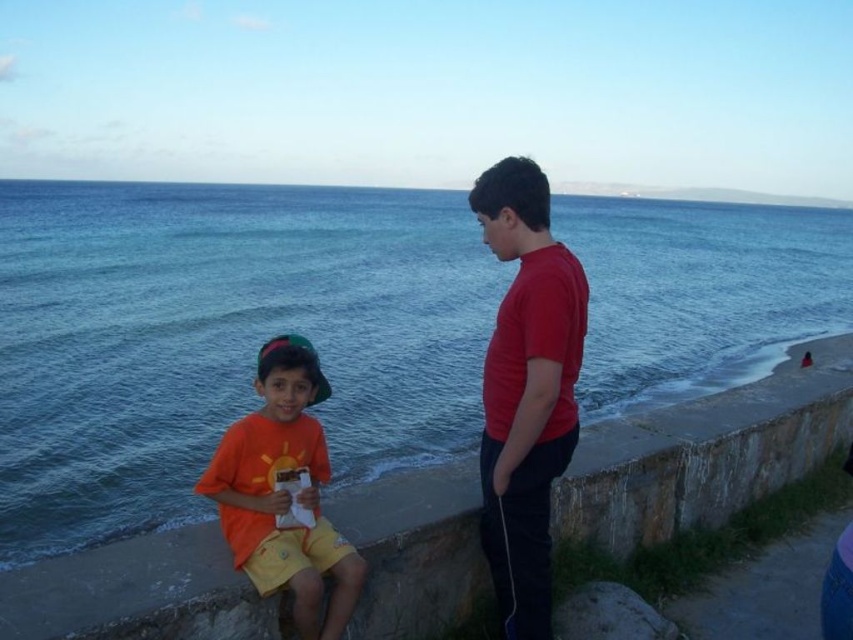
Between blue water at sea left and matte red shirt at right, which one is positioned lower?

matte red shirt at right is below.

Measure the distance between point (762, 310) and camera.

They are 27.11 meters apart.

Where is `blue water at sea left`? blue water at sea left is located at coordinates (219, 339).

Is point (549, 250) more distant than point (270, 580)?

Yes, point (549, 250) is behind point (270, 580).

Can you confirm if matte red shirt at right is bigger than orange matte shirt at center?

Actually, matte red shirt at right might be smaller than orange matte shirt at center.

Describe the element at coordinates (526, 388) in the screenshot. I see `matte red shirt at right` at that location.

Image resolution: width=853 pixels, height=640 pixels. Identify the location of matte red shirt at right. (526, 388).

Between blue water at sea left and orange matte shirt at center, which one has less height?

orange matte shirt at center is shorter.

Locate an element on the screen. The image size is (853, 640). blue water at sea left is located at coordinates (219, 339).

Who is more distant from viewer, (340, 324) or (286, 468)?

The point (340, 324) is behind.

The height and width of the screenshot is (640, 853). In order to click on blue water at sea left in this screenshot , I will do `click(219, 339)`.